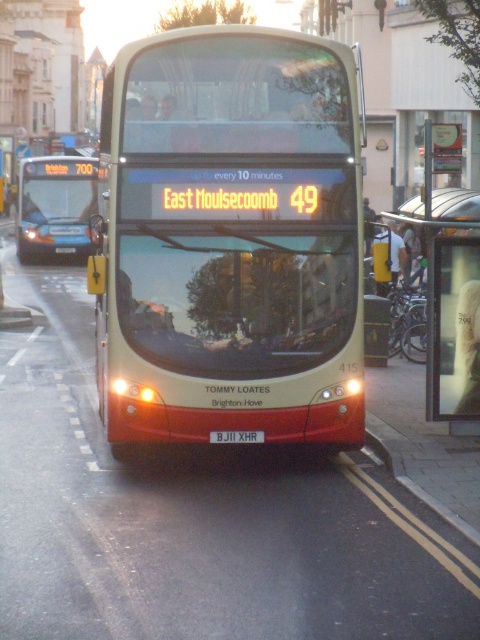
Is transparent glass bus stop at center smaller than matte blue bus at left?

Indeed, transparent glass bus stop at center has a smaller size compared to matte blue bus at left.

Is transparent glass bus stop at center below matte blue bus at left?

Yes.

What do you see at coordinates (450, 300) in the screenshot? The height and width of the screenshot is (640, 480). I see `transparent glass bus stop at center` at bounding box center [450, 300].

Locate an element on the screen. transparent glass bus stop at center is located at coordinates (450, 300).

Does point (187, 326) lie in front of point (216, 436)?

Yes, it is.

Who is more forward, (262, 422) or (219, 435)?

Point (219, 435) is more forward.

What do you see at coordinates (230, 240) in the screenshot? This screenshot has height=640, width=480. I see `beige matte bus at center` at bounding box center [230, 240].

Identify the location of beige matte bus at center. Image resolution: width=480 pixels, height=640 pixels. (230, 240).

Does metallic gray curb at lower right have a lesser width compared to black plastic license plate at center?

Correct, metallic gray curb at lower right's width is less than black plastic license plate at center's.

What do you see at coordinates (418, 486) in the screenshot? I see `metallic gray curb at lower right` at bounding box center [418, 486].

You are a GUI agent. You are given a task and a screenshot of the screen. Output one action in this format:
    pyautogui.click(x=<x>, y=<y>)
    Task: Click on the metallic gray curb at lower right
    
    Given the screenshot: What is the action you would take?
    pyautogui.click(x=418, y=486)